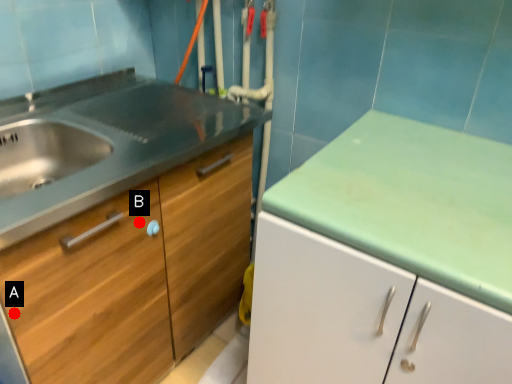
Question: Two points are circled on the image, labeled by A and B beside each circle. Which point is closer to the camera?

Choices:
 (A) A is closer
 (B) B is closer

Answer: (A)